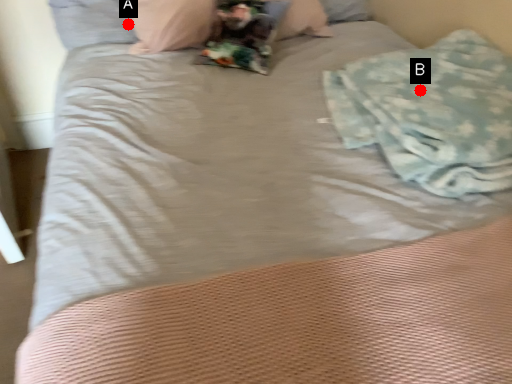
Question: Two points are circled on the image, labeled by A and B beside each circle. Which of the following is the closest to the observer?

Choices:
 (A) A is closer
 (B) B is closer

Answer: (B)